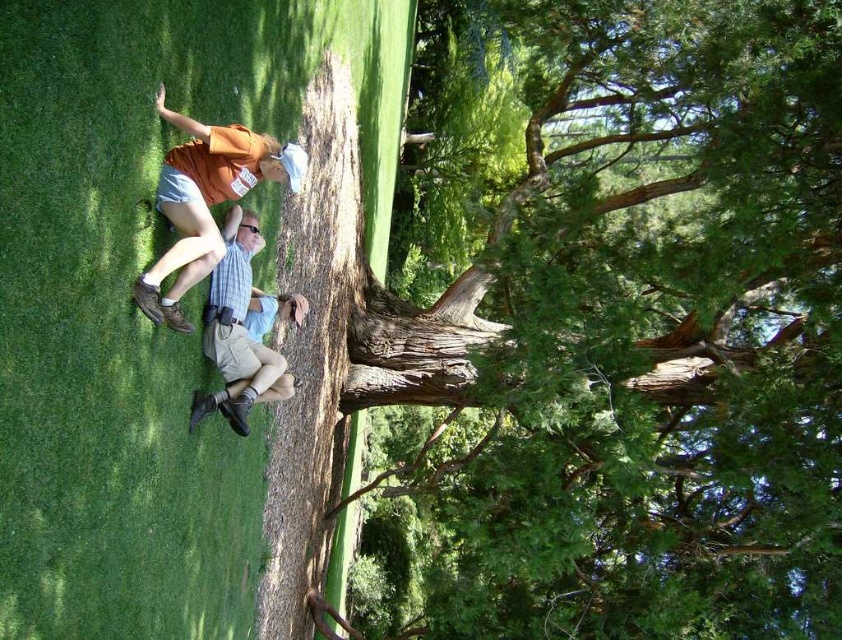
Between green textured tree at center and light blue denim shorts at center, which one has less height?

Standing shorter between the two is light blue denim shorts at center.

Can you confirm if green textured tree at center is shorter than light blue denim shorts at center?

No, green textured tree at center is not shorter than light blue denim shorts at center.

Image resolution: width=842 pixels, height=640 pixels. Identify the location of green textured tree at center. (640, 339).

Identify the location of green textured tree at center. The height and width of the screenshot is (640, 842). (640, 339).

Is orange cotton shirt at upper left wider than light blue denim shorts at center?

Indeed, orange cotton shirt at upper left has a greater width compared to light blue denim shorts at center.

Is orange cotton shirt at upper left thinner than light blue denim shorts at center?

No, orange cotton shirt at upper left is not thinner than light blue denim shorts at center.

Does point (160, 209) come in front of point (272, 298)?

Yes, it is.

This screenshot has width=842, height=640. Identify the location of orange cotton shirt at upper left. (205, 202).

Who is positioned more to the left, green textured tree at center or orange cotton shirt at upper left?

orange cotton shirt at upper left is more to the left.

Which is behind, point (789, 449) or point (201, 262)?

Point (789, 449)

Between point (467, 381) and point (137, 276), which one is positioned behind?

Point (467, 381)

Where is `green textured tree at center`? This screenshot has height=640, width=842. green textured tree at center is located at coordinates (640, 339).